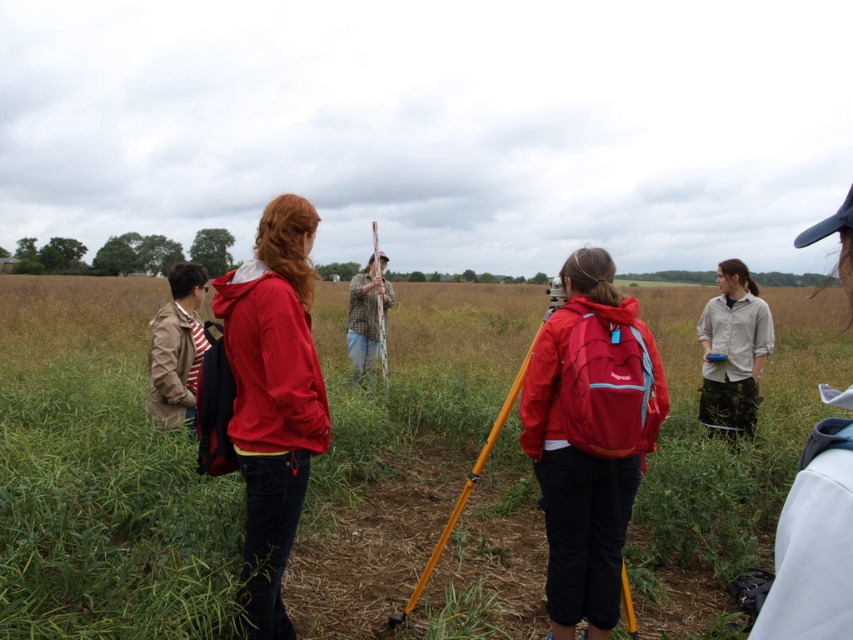
You are a hiker trying to locate two people in the field. You see the matte red jacket at center and the light gray shirt at right. Which one is positioned lower in the image?

The matte red jacket at center is located below the light gray shirt at right, so it is positioned lower in the image.

You are a photographer trying to capture a group photo of the camouflage pants at center and the striped cotton shirt at left. To ensure both are in frame, which direction should you move the camera slightly? Please specify left or right.

The camouflage pants at center is positioned on the right side of striped cotton shirt at left. To include both in the frame, move the camera slightly to the right to capture the camouflage pants at center and then adjust back, or pan the camera to the right to ensure both subjects are within the shot.